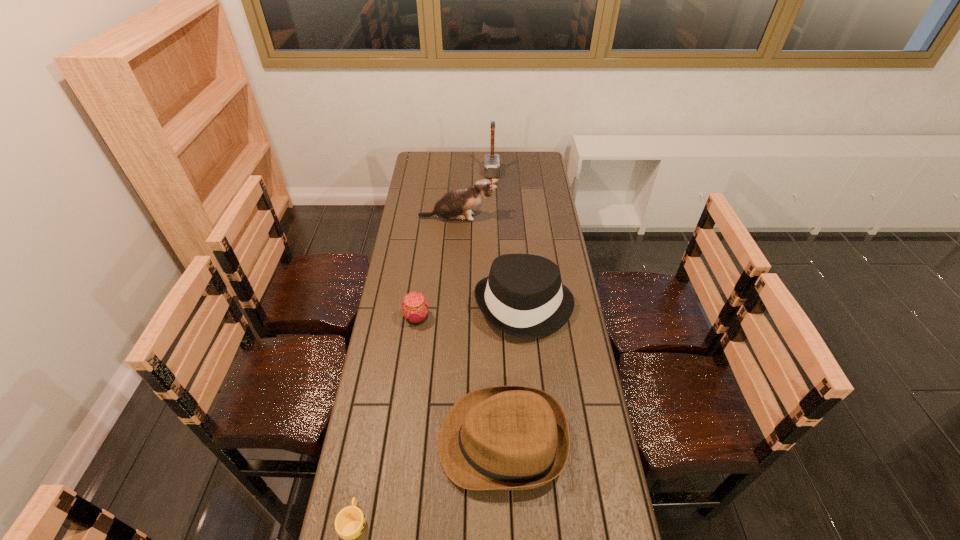
Locate an element on the screen. vacant space located 0.280m at the face of the cat is located at coordinates (558, 218).

Image resolution: width=960 pixels, height=540 pixels. Find the location of `blank space located on the back of the farther fedora`. blank space located on the back of the farther fedora is located at coordinates (519, 245).

Where is `vacant space located 0.240m on the front-facing side of the second nearest object`? vacant space located 0.240m on the front-facing side of the second nearest object is located at coordinates coord(357,442).

Find the location of a particular element. This screenshot has height=540, width=960. free point located on the front-facing side of the second nearest object is located at coordinates (388, 442).

Where is `vacant region located 0.150m on the front-facing side of the second nearest object`? This screenshot has height=540, width=960. vacant region located 0.150m on the front-facing side of the second nearest object is located at coordinates (x=388, y=442).

Where is `free location located 0.200m on the back of the jam`? The height and width of the screenshot is (540, 960). free location located 0.200m on the back of the jam is located at coordinates (423, 272).

Find the location of `object that is at the far edge`. object that is at the far edge is located at coordinates (491, 161).

This screenshot has width=960, height=540. Identify the location of cat that is at the left edge. (457, 204).

You are a GUI agent. You are given a task and a screenshot of the screen. Output one action in this format:
    pyautogui.click(x=<x>, y=<y>)
    Task: Click on the jam that is at the left edge
    
    Given the screenshot: What is the action you would take?
    pyautogui.click(x=415, y=307)

The image size is (960, 540). Identify the location of free spot at the far edge of the desktop. (444, 159).